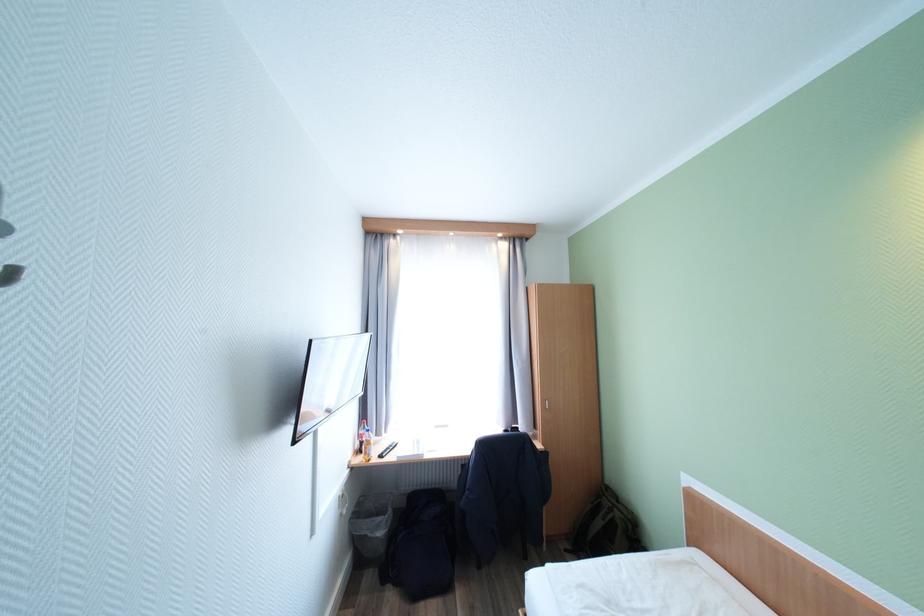
What do you see at coordinates (546, 400) in the screenshot? I see `the wardrobe handle` at bounding box center [546, 400].